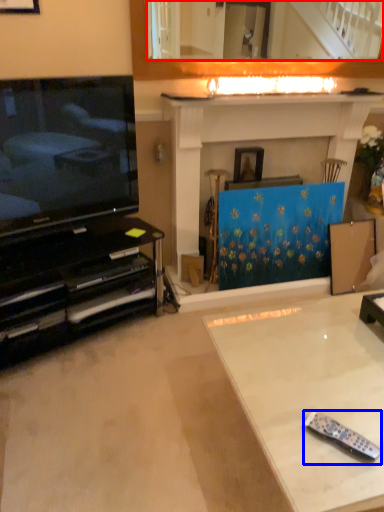
Question: Among these objects, which one is nearest to the camera, mirror (highlighted by a red box) or remote control (highlighted by a blue box)?

Choices:
 (A) mirror
 (B) remote control

Answer: (B)